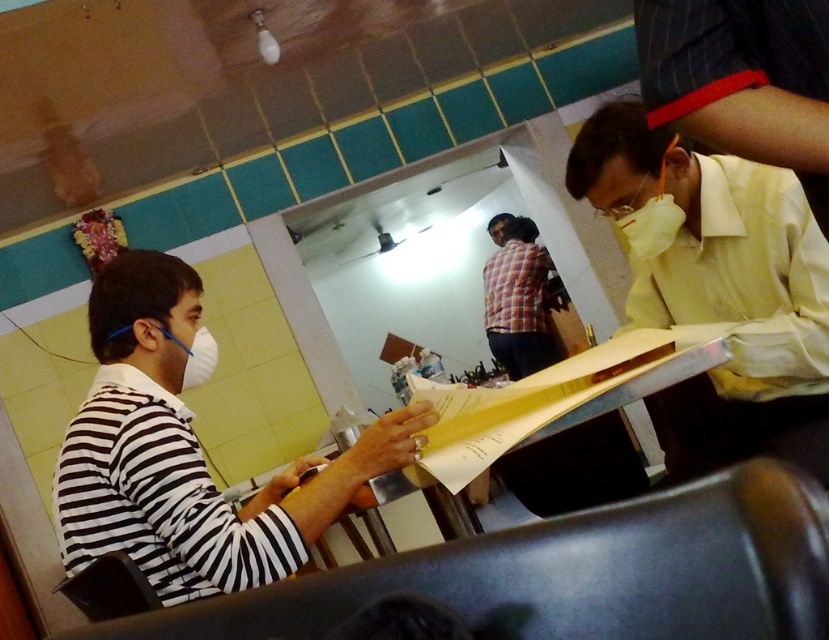
Is point (665, 216) positioned in front of point (187, 384)?

No, (665, 216) is further to viewer.

Does point (638, 230) come closer to viewer compared to point (192, 385)?

No.

Locate an element on the screen. white matte mask at upper right is located at coordinates (651, 225).

Can you confirm if yellow cotton shirt at right is wider than white matte mask at upper right?

Correct, the width of yellow cotton shirt at right exceeds that of white matte mask at upper right.

Measure the distance between yellow cotton shirt at right and camera.

The distance of yellow cotton shirt at right from camera is 27.74 inches.

Find the location of a particular element. The image size is (829, 640). yellow cotton shirt at right is located at coordinates (742, 81).

Does yellow smooth shirt at right have a larger size compared to yellow cotton shirt at right?

Indeed, yellow smooth shirt at right has a larger size compared to yellow cotton shirt at right.

Does point (682, 218) come farther from viewer compared to point (684, 99)?

Yes, point (682, 218) is farther from viewer.

Identify the location of yellow smooth shirt at right. (716, 289).